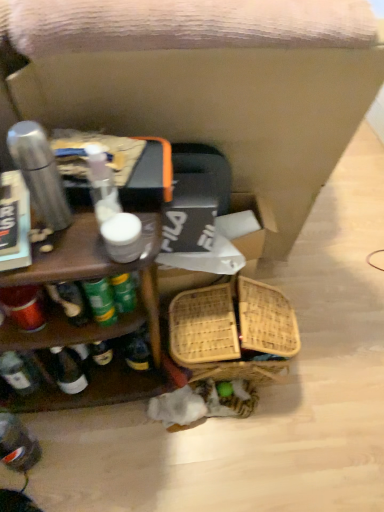
Identify the location of wooden shelf at left. The width and height of the screenshot is (384, 512). (90, 317).

What do you see at coordinates (90, 317) in the screenshot?
I see `wooden shelf at left` at bounding box center [90, 317].

Measure the distance between woven cardboard box at center and camera.

They are 3.65 feet apart.

The image size is (384, 512). What are the coordinates of `woven bamboo basket at lower center` in the screenshot? It's located at (233, 331).

The height and width of the screenshot is (512, 384). Describe the element at coordinates (233, 331) in the screenshot. I see `woven bamboo basket at lower center` at that location.

Where is `translucent plastic bottle at lower left`? translucent plastic bottle at lower left is located at coordinates click(17, 444).

Where is `storage box lying on the right of wooden swivel chair at center`? storage box lying on the right of wooden swivel chair at center is located at coordinates (221, 247).

Based on the photo, in terms of height, does wooden swivel chair at center look taller or shorter compared to woven cardboard box at center?

Clearly, wooden swivel chair at center is taller compared to woven cardboard box at center.

Is wooden swivel chair at center aimed at woven cardboard box at center?

No, wooden swivel chair at center is not facing towards woven cardboard box at center.

From the picture: Between translucent plastic bottle at lower left and wooden swivel chair at center, which one has smaller width?

Thinner between the two is translucent plastic bottle at lower left.

Does translucent plastic bottle at lower left contain wooden swivel chair at center?

No, translucent plastic bottle at lower left does not contain wooden swivel chair at center.

Which is more to the left, translucent plastic bottle at lower left or wooden swivel chair at center?

Positioned to the left is translucent plastic bottle at lower left.

Considering the sizes of objects translucent plastic bottle at lower left and wooden swivel chair at center in the image provided, who is taller, translucent plastic bottle at lower left or wooden swivel chair at center?

wooden swivel chair at center.

Considering the relative positions of woven cardboard box at center and translucent plastic bottle at lower left in the image provided, is woven cardboard box at center to the left or to the right of translucent plastic bottle at lower left?

In the image, woven cardboard box at center appears on the right side of translucent plastic bottle at lower left.

Considering the sizes of woven cardboard box at center and translucent plastic bottle at lower left in the image, is woven cardboard box at center bigger or smaller than translucent plastic bottle at lower left?

Clearly, woven cardboard box at center is larger in size than translucent plastic bottle at lower left.

Which object is thinner, woven cardboard box at center or translucent plastic bottle at lower left?

With smaller width is translucent plastic bottle at lower left.

From the picture: Are woven cardboard box at center and translucent plastic bottle at lower left located far from each other?

No, woven cardboard box at center is not far away from translucent plastic bottle at lower left.

Considering the relative positions of woven cardboard box at center and wooden swivel chair at center in the image provided, is woven cardboard box at center to the right of wooden swivel chair at center from the viewer's perspective?

Yes.

Is woven cardboard box at center shorter than wooden swivel chair at center?

Correct, woven cardboard box at center is not as tall as wooden swivel chair at center.

Considering the positions of point (178, 267) and point (330, 95), is point (178, 267) closer or farther from the camera than point (330, 95)?

Point (178, 267) appears to be farther away from the viewer than point (330, 95).

Is woven cardboard box at center wider or thinner than wooden swivel chair at center?

Clearly, woven cardboard box at center has less width compared to wooden swivel chair at center.

Is wooden shelf at left in front of or behind translucent plastic bottle at lower left in the image?

wooden shelf at left is in front of translucent plastic bottle at lower left.

Is point (62, 232) positioned before point (0, 436)?

Yes, point (62, 232) is in front of point (0, 436).

From the image's perspective, is wooden shelf at left below translucent plastic bottle at lower left?

Actually, wooden shelf at left appears above translucent plastic bottle at lower left in the image.

Is woven bamboo basket at lower center situated inside wooden swivel chair at center or outside?

woven bamboo basket at lower center is outside wooden swivel chair at center.

Does woven bamboo basket at lower center touch wooden swivel chair at center?

woven bamboo basket at lower center and wooden swivel chair at center are not in contact.

Is woven bamboo basket at lower center aimed at wooden swivel chair at center?

No, woven bamboo basket at lower center is not oriented towards wooden swivel chair at center.

Which of these two, woven bamboo basket at lower center or wooden swivel chair at center, stands shorter?

With less height is woven bamboo basket at lower center.

Considering the relative positions of wooden swivel chair at center and wooden shelf at left in the image provided, is wooden swivel chair at center to the left of wooden shelf at left from the viewer's perspective?

No.

What are the coordinates of `swivel chair above the wooden shelf at left (from the image's perspective)` in the screenshot? It's located at (209, 81).

How many degrees apart are the facing directions of wooden swivel chair at center and wooden shelf at left?

wooden swivel chair at center and wooden shelf at left are facing 180 degrees away from each other.

How far apart are wooden swivel chair at center and wooden shelf at left?

They are 16.99 inches apart.

At what (x,y) coordinates should I click in order to perform the action: click on storage box behind the wooden swivel chair at center. Please return your answer as a coordinate pair (x, y). This screenshot has height=512, width=384. Looking at the image, I should click on (221, 247).

This screenshot has width=384, height=512. Find the location of `swivel chair above the translucent plastic bottle at lower left (from a real-world perspective)`. swivel chair above the translucent plastic bottle at lower left (from a real-world perspective) is located at coordinates (209, 81).

Estimate the real-world distances between objects in this image. Which object is further from wooden swivel chair at center, woven cardboard box at center or translucent plastic bottle at lower left?

translucent plastic bottle at lower left is positioned further to the anchor wooden swivel chair at center.

From the image, which object appears to be farther from translucent plastic bottle at lower left, woven cardboard box at center or wooden shelf at left?

woven cardboard box at center.

Looking at the image, which one is located further to woven bamboo basket at lower center, translucent plastic bottle at lower left or wooden swivel chair at center?

Among the two, translucent plastic bottle at lower left is located further to woven bamboo basket at lower center.

Estimate the real-world distances between objects in this image. Which object is further from woven cardboard box at center, woven bamboo basket at lower center or wooden swivel chair at center?

wooden swivel chair at center is positioned further to the anchor woven cardboard box at center.

Estimate the real-world distances between objects in this image. Which object is closer to wooden shelf at left, translucent plastic bottle at lower left or woven cardboard box at center?

Based on the image, woven cardboard box at center appears to be nearer to wooden shelf at left.

Looking at the image, which one is located further to translucent plastic bottle at lower left, woven bamboo basket at lower center or wooden swivel chair at center?

wooden swivel chair at center is further to translucent plastic bottle at lower left.

Estimate the real-world distances between objects in this image. Which object is further from woven bamboo basket at lower center, translucent plastic bottle at lower left or wooden shelf at left?

The object further to woven bamboo basket at lower center is translucent plastic bottle at lower left.

From the image, which object appears to be farther from wooden swivel chair at center, translucent plastic bottle at lower left or woven bamboo basket at lower center?

translucent plastic bottle at lower left.

Identify the location of basket between wooden swivel chair at center and translucent plastic bottle at lower left in the up-down direction. (233, 331).

The height and width of the screenshot is (512, 384). Find the location of `storage box between wooden swivel chair at center and woven bamboo basket at lower center vertically`. storage box between wooden swivel chair at center and woven bamboo basket at lower center vertically is located at coordinates click(221, 247).

Identify the location of shelf between wooden swivel chair at center and woven bamboo basket at lower center in the vertical direction. (90, 317).

The height and width of the screenshot is (512, 384). In order to click on storage box that lies between wooden swivel chair at center and wooden shelf at left from top to bottom in this screenshot , I will do `click(221, 247)`.